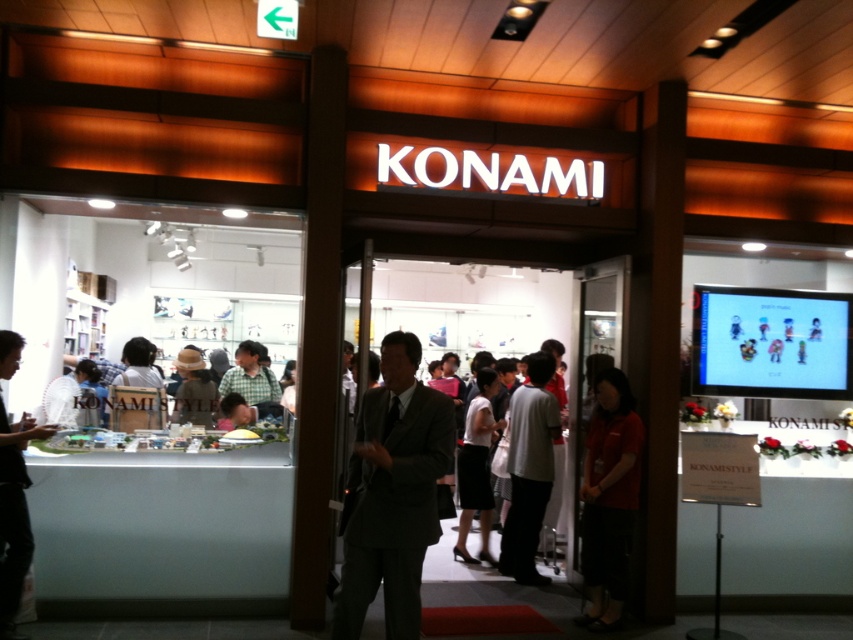
You are a customer looking to buy a shirt in this Konami store. You see a red smooth shirt at lower right and a gray fabric shirt at center. Which shirt is shorter in height?

The red smooth shirt at lower right is not as tall as the gray fabric shirt at center, so the red smooth shirt at lower right is shorter in height.

You are a customer in the Konami store entrance and you want to pick up both the red smooth shirt at lower right and the gray fabric shirt at center. Can you reach both items without moving your position? Explain your answer.

The red smooth shirt at lower right and gray fabric shirt at center are 86.64 centimeters apart. Since the distance between them is over 80 centimeters, you would need to move your position to reach both items.